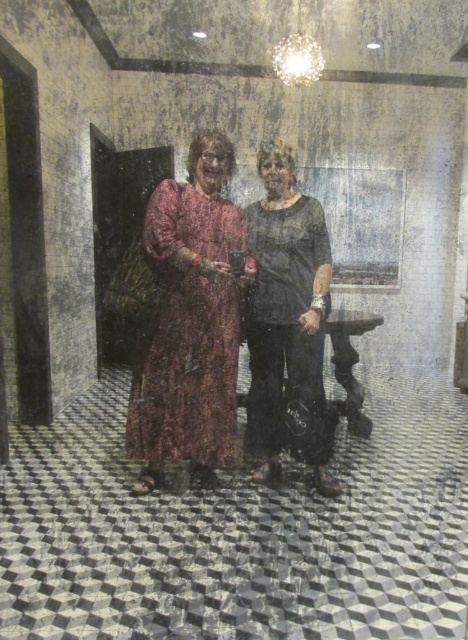
You are trying to decide which clothing item to take with you from the scene. Both the patterned fabric dress at center and the matte black shirt at center are on the floor. If you can only carry one, which one would you choose based on size alone?

The patterned fabric dress at center is bigger than the matte black shirt at center, so you should choose the patterned fabric dress at center because it takes up more space and might be more useful to carry.